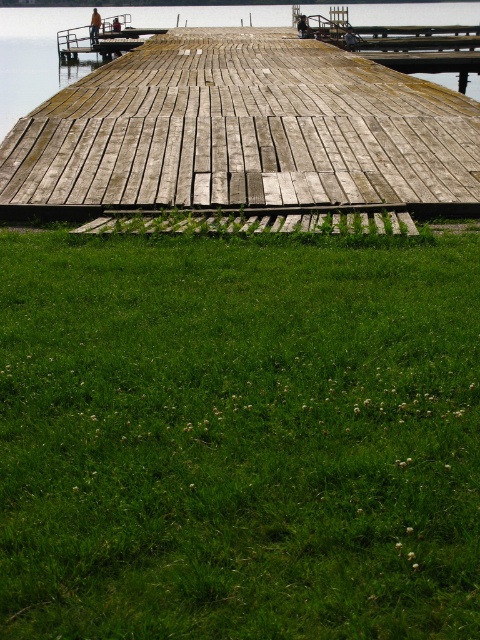
Question: Which object appears closest to the camera in this image?

Choices:
 (A) green grass at lower center
 (B) weathered wood dock at center

Answer: (A)

Question: Observing the image, what is the correct spatial positioning of green grass at lower center in reference to weathered wood dock at center?

Choices:
 (A) above
 (B) below

Answer: (B)

Question: Which point appears farthest from the camera in this image?

Choices:
 (A) (424, 372)
 (B) (337, 134)

Answer: (B)

Question: Can you confirm if green grass at lower center is positioned above weathered wood dock at center?

Choices:
 (A) yes
 (B) no

Answer: (B)

Question: Is green grass at lower center to the right of weathered wood dock at center from the viewer's perspective?

Choices:
 (A) yes
 (B) no

Answer: (A)